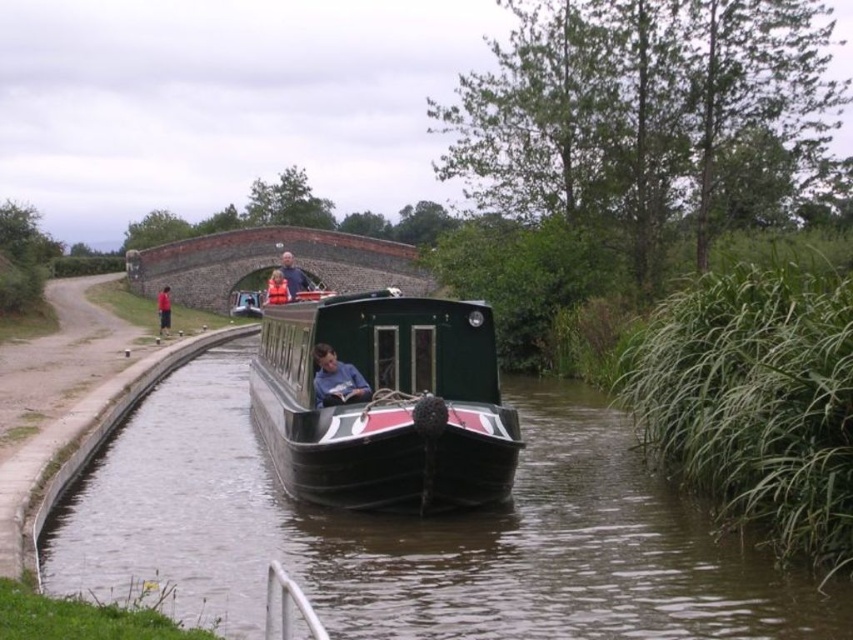
Question: Which object is closer to the camera taking this photo?

Choices:
 (A) dark blue shirt at center
 (B) green polished wood boat at center
 (C) red fabric person at left
 (D) blue fabric shirt at center

Answer: (B)

Question: Which object is closer to the camera taking this photo?

Choices:
 (A) orange fabric jacket at center
 (B) blue fabric shirt at center
 (C) red fabric person at left

Answer: (B)

Question: Is blue fabric shirt at center to the right of red fabric person at left from the viewer's perspective?

Choices:
 (A) yes
 (B) no

Answer: (A)

Question: Which point is closer to the camera taking this photo?

Choices:
 (A) (300, 272)
 (B) (160, 296)
 (C) (345, 380)

Answer: (C)

Question: In this image, where is orange fabric jacket at center located relative to red fabric person at left?

Choices:
 (A) above
 (B) below

Answer: (A)

Question: Does blue fabric shirt at center come behind dark blue shirt at center?

Choices:
 (A) no
 (B) yes

Answer: (A)